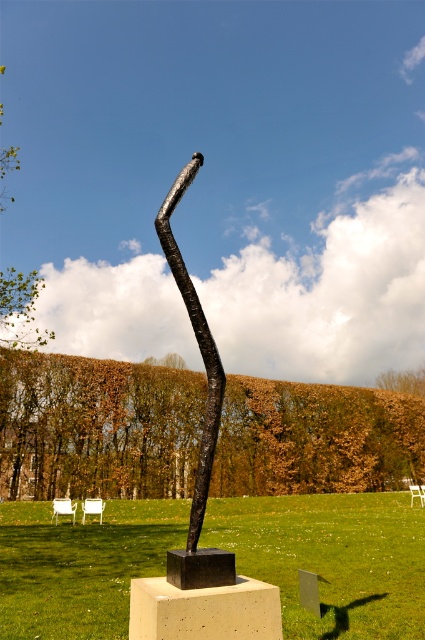
Looking at this image, you are a gardener who needs to mow the green grass at center. However, there is a black textured pole at center in the way. Can you mow the grass around the pole without hitting it?

The green grass at center is much taller than the black textured pole at center, so you can mow around the pole without hitting it as long as you avoid the pole itself.

You are standing in the park and see the green grass at center and the black textured pole at center. Which object is closer to the ground?

The green grass at center is closer to the ground as it is positioned below the black textured pole at center.